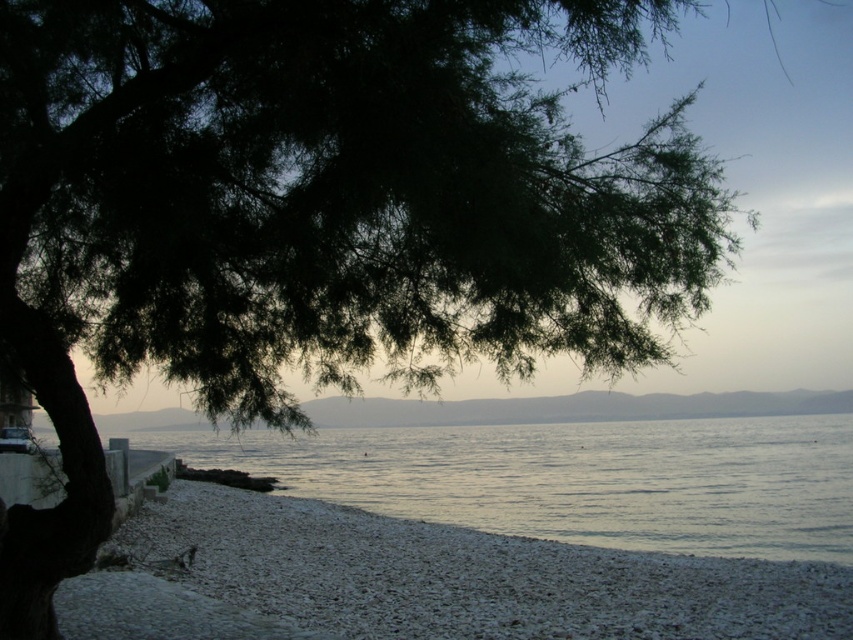
You are standing at the center of the image and want to walk to the gray gravel beach at lower left. Which direction should you move?

You should move to the lower left direction to reach the gray gravel beach at lower left.

You are a hiker carrying a heavy backpack and need to cross from the gray gravel beach at lower left to the clear water at center. The path between them is 5.13 meters. If your backpack weighs 15 kilograms, will the distance be manageable for you to carry it?

The distance between the gray gravel beach at lower left and the clear water at center is 5.13 meters. Since this distance is relatively short, you should be able to manage carrying the 15 kg backpack over this short distance without significant difficulty.